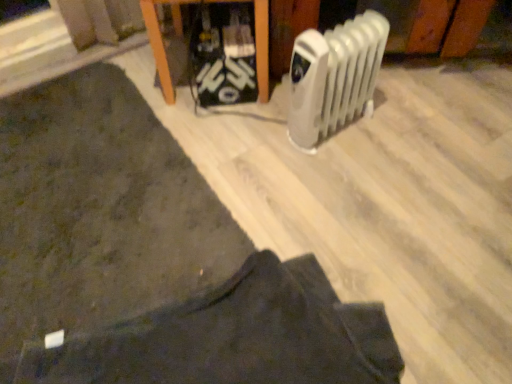
This screenshot has height=384, width=512. Describe the element at coordinates (100, 211) in the screenshot. I see `dark fabric mat at lower left` at that location.

The height and width of the screenshot is (384, 512). What do you see at coordinates (334, 77) in the screenshot?
I see `white plastic radiator at right` at bounding box center [334, 77].

This screenshot has height=384, width=512. What are the coordinates of `dark fabric pants at lower center` in the screenshot? It's located at (233, 337).

Where is `dark fabric mat at lower left`? dark fabric mat at lower left is located at coordinates (100, 211).

Who is shorter, wooden table at upper center or dark fabric mat at lower left?

Standing shorter between the two is dark fabric mat at lower left.

Considering their positions, is wooden table at upper center located in front of or behind dark fabric mat at lower left?

Clearly, wooden table at upper center is behind dark fabric mat at lower left.

Is wooden table at upper center placed right next to dark fabric mat at lower left?

No, wooden table at upper center is not in contact with dark fabric mat at lower left.

Which object is positioned more to the right, dark fabric pants at lower center or dark fabric mat at lower left?

Positioned to the right is dark fabric pants at lower center.

Who is taller, dark fabric pants at lower center or dark fabric mat at lower left?

dark fabric mat at lower left is taller.

What's the angular difference between dark fabric pants at lower center and dark fabric mat at lower left's facing directions?

dark fabric pants at lower center and dark fabric mat at lower left are facing 0.000858 degrees away from each other.

Which object is thinner, dark fabric pants at lower center or dark fabric mat at lower left?

Thinner between the two is dark fabric pants at lower center.

At what (x,y) coordinates should I click in order to perform the action: click on radiator above the dark fabric mat at lower left (from a real-world perspective). Please return your answer as a coordinate pair (x, y). The image size is (512, 384). Looking at the image, I should click on (334, 77).

Which of these two, dark fabric mat at lower left or white plastic radiator at right, stands shorter?

With less height is dark fabric mat at lower left.

Considering the relative sizes of dark fabric mat at lower left and white plastic radiator at right in the image provided, is dark fabric mat at lower left thinner than white plastic radiator at right?

Incorrect, the width of dark fabric mat at lower left is not less than that of white plastic radiator at right.

How many degrees apart are the facing directions of dark fabric mat at lower left and white plastic radiator at right?

5.71 degrees separate the facing orientations of dark fabric mat at lower left and white plastic radiator at right.

Which object is wider, dark fabric pants at lower center or white plastic radiator at right?

With larger width is dark fabric pants at lower center.

Who is smaller, dark fabric pants at lower center or white plastic radiator at right?

With smaller size is white plastic radiator at right.

Is dark fabric pants at lower center situated inside white plastic radiator at right or outside?

dark fabric pants at lower center is not inside white plastic radiator at right, it's outside.

How distant is dark fabric pants at lower center from white plastic radiator at right?

They are 23.48 inches apart.

Would you consider dark fabric pants at lower center to be distant from wooden table at upper center?

dark fabric pants at lower center is actually quite close to wooden table at upper center.

Is dark fabric pants at lower center bigger or smaller than wooden table at upper center?

Clearly, dark fabric pants at lower center is smaller in size than wooden table at upper center.

Is dark fabric pants at lower center inside or outside of wooden table at upper center?

dark fabric pants at lower center is not inside wooden table at upper center, it's outside.

In the scene shown: From a real-world perspective, is wooden table at upper center above or below dark fabric pants at lower center?

wooden table at upper center is above dark fabric pants at lower center.

In the image, is wooden table at upper center on the left side or the right side of dark fabric pants at lower center?

In the image, wooden table at upper center appears on the left side of dark fabric pants at lower center.

Considering the points (315, 10) and (238, 347), which point is behind, point (315, 10) or point (238, 347)?

The point (315, 10) is behind.

Based on the photo, considering the relative positions of wooden table at upper center and dark fabric pants at lower center in the image provided, is wooden table at upper center in front of dark fabric pants at lower center?

No.

Which object is more forward, dark fabric mat at lower left or wooden table at upper center?

Positioned in front is dark fabric mat at lower left.

From the image's perspective, is dark fabric mat at lower left positioned above or below wooden table at upper center?

Based on their image positions, dark fabric mat at lower left is located beneath wooden table at upper center.

Is dark fabric mat at lower left oriented away from wooden table at upper center?

dark fabric mat at lower left does not have its back to wooden table at upper center.

From a real-world perspective, is dark fabric mat at lower left positioned over wooden table at upper center based on gravity?

Result: No.

The image size is (512, 384). There is a dark fabric mat at lower left. Find the location of `furniture above it (from a real-world perspective)`. furniture above it (from a real-world perspective) is located at coordinates (277, 34).

Where is `mat above the dark fabric pants at lower center (from the image's perspective)`? The image size is (512, 384). mat above the dark fabric pants at lower center (from the image's perspective) is located at coordinates pyautogui.click(x=100, y=211).

Based on their spatial positions, is dark fabric pants at lower center or white plastic radiator at right further from wooden table at upper center?

Based on the image, dark fabric pants at lower center appears to be further to wooden table at upper center.

Which object lies further to the anchor point white plastic radiator at right, dark fabric mat at lower left or wooden table at upper center?

dark fabric mat at lower left lies further to white plastic radiator at right than the other object.

Estimate the real-world distances between objects in this image. Which object is closer to dark fabric pants at lower center, wooden table at upper center or dark fabric mat at lower left?

dark fabric mat at lower left is closer to dark fabric pants at lower center.

When comparing their distances from dark fabric pants at lower center, does white plastic radiator at right or dark fabric mat at lower left seem closer?

The object closer to dark fabric pants at lower center is dark fabric mat at lower left.

Which object lies further to the anchor point dark fabric mat at lower left, white plastic radiator at right or wooden table at upper center?

The object further to dark fabric mat at lower left is white plastic radiator at right.

Based on their spatial positions, is dark fabric mat at lower left or white plastic radiator at right closer to wooden table at upper center?

white plastic radiator at right.

When comparing their distances from white plastic radiator at right, does wooden table at upper center or dark fabric pants at lower center seem further?

dark fabric pants at lower center lies further to white plastic radiator at right than the other object.

Looking at the image, which one is located further to dark fabric pants at lower center, wooden table at upper center or white plastic radiator at right?

wooden table at upper center is positioned further to the anchor dark fabric pants at lower center.

Image resolution: width=512 pixels, height=384 pixels. In order to click on mat between white plastic radiator at right and dark fabric pants at lower center in the vertical direction in this screenshot , I will do 100,211.

Image resolution: width=512 pixels, height=384 pixels. What are the coordinates of `mat between wooden table at upper center and dark fabric pants at lower center in the up-down direction` in the screenshot? It's located at (100, 211).

This screenshot has height=384, width=512. What are the coordinates of `radiator between wooden table at upper center and dark fabric pants at lower center in the vertical direction` in the screenshot? It's located at (334, 77).

Find the location of a particular element. The height and width of the screenshot is (384, 512). furniture between dark fabric mat at lower left and white plastic radiator at right from left to right is located at coordinates (277, 34).